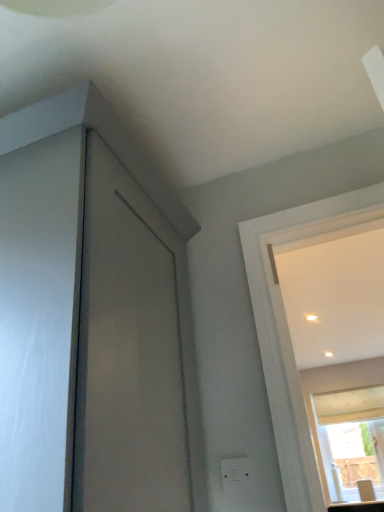
Question: From a real-world perspective, is white plastic electric outlet at lower center located higher than matte white countertop at lower right?

Choices:
 (A) yes
 (B) no

Answer: (A)

Question: Is the position of white plastic electric outlet at lower center less distant than that of matte white countertop at lower right?

Choices:
 (A) yes
 (B) no

Answer: (A)

Question: Does white plastic electric outlet at lower center appear on the right side of matte white countertop at lower right?

Choices:
 (A) yes
 (B) no

Answer: (B)

Question: Is matte white countertop at lower right surrounded by white plastic electric outlet at lower center?

Choices:
 (A) no
 (B) yes

Answer: (A)

Question: From the image's perspective, is white plastic electric outlet at lower center below matte white countertop at lower right?

Choices:
 (A) no
 (B) yes

Answer: (A)

Question: Would you say white plastic electric outlet at lower center is inside or outside matte white countertop at lower right?

Choices:
 (A) inside
 (B) outside

Answer: (B)

Question: Considering the relative positions of white plastic electric outlet at lower center and matte white countertop at lower right in the image provided, is white plastic electric outlet at lower center to the left or to the right of matte white countertop at lower right?

Choices:
 (A) left
 (B) right

Answer: (A)

Question: From the image's perspective, relative to matte white countertop at lower right, is white plastic electric outlet at lower center above or below?

Choices:
 (A) below
 (B) above

Answer: (B)

Question: Is white plastic electric outlet at lower center in front of or behind matte white countertop at lower right in the image?

Choices:
 (A) behind
 (B) front

Answer: (B)

Question: Considering the positions of point (374, 432) and point (238, 481), is point (374, 432) closer or farther from the camera than point (238, 481)?

Choices:
 (A) closer
 (B) farther

Answer: (B)

Question: In the image, is transparent glass window at upper right on the left side or the right side of white plastic electric outlet at lower center?

Choices:
 (A) left
 (B) right

Answer: (B)

Question: From the image's perspective, is transparent glass window at upper right positioned above or below white plastic electric outlet at lower center?

Choices:
 (A) below
 (B) above

Answer: (A)

Question: From a real-world perspective, is transparent glass window at upper right positioned above or below white plastic electric outlet at lower center?

Choices:
 (A) above
 (B) below

Answer: (A)

Question: Is white plastic electric outlet at lower center in front of or behind transparent glass window at upper right in the image?

Choices:
 (A) front
 (B) behind

Answer: (A)

Question: Considering the positions of white plastic electric outlet at lower center and transparent glass window at upper right in the image, is white plastic electric outlet at lower center wider or thinner than transparent glass window at upper right?

Choices:
 (A) thin
 (B) wide

Answer: (A)